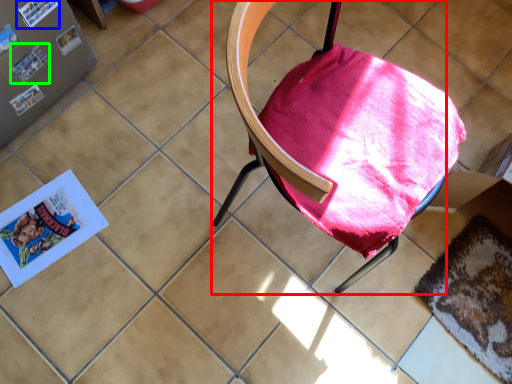
Question: Which object is positioned farthest from chair (highlighted by a red box)? Select from paperback book (highlighted by a blue box) and paperback book (highlighted by a green box).

Choices:
 (A) paperback book
 (B) paperback book

Answer: (B)